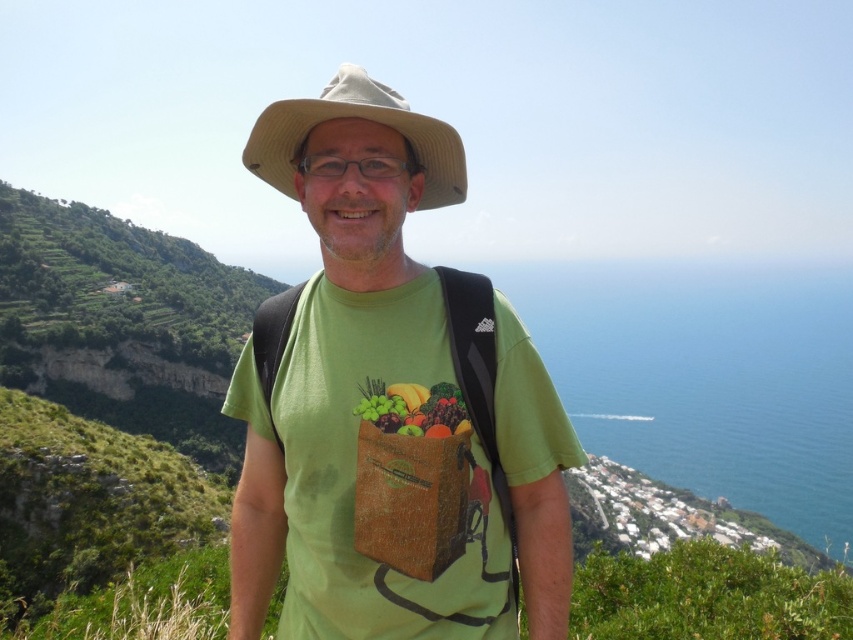
Question: Is green fabric t-shirt at center thinner than glossy plastic bag of fruits at center?

Choices:
 (A) yes
 (B) no

Answer: (B)

Question: Which object is the farthest from the green fabric t-shirt at center?

Choices:
 (A) glossy plastic bag of fruits at center
 (B) beige fabric cowboy hat at center

Answer: (B)

Question: Which point is closer to the camera?

Choices:
 (A) (425, 401)
 (B) (440, 196)
 (C) (308, 566)

Answer: (A)

Question: Among these points, which one is nearest to the camera?

Choices:
 (A) (328, 461)
 (B) (274, 104)

Answer: (B)

Question: Does beige fabric cowboy hat at center have a lesser width compared to glossy plastic bag of fruits at center?

Choices:
 (A) yes
 (B) no

Answer: (B)

Question: Does green fabric t-shirt at center appear on the left side of beige fabric cowboy hat at center?

Choices:
 (A) no
 (B) yes

Answer: (A)